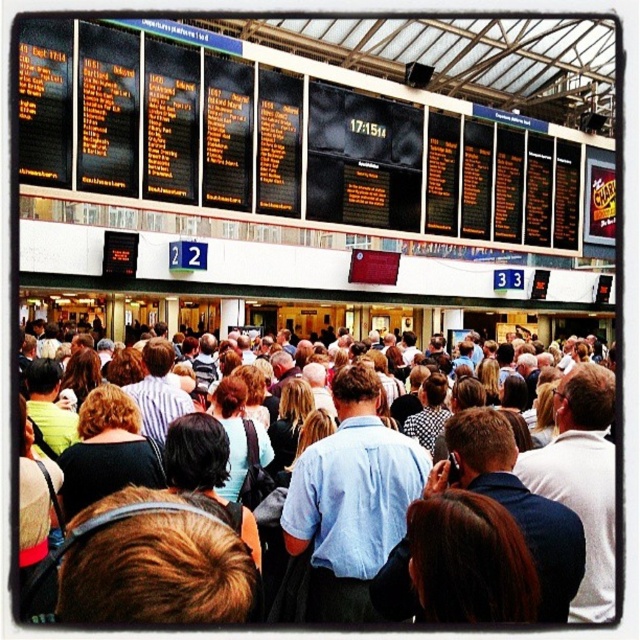
Question: Can you confirm if black digital display at upper center is positioned to the left of brown hair at center?

Choices:
 (A) no
 (B) yes

Answer: (A)

Question: Can you confirm if black digital display at upper center is smaller than brown hair at center?

Choices:
 (A) yes
 (B) no

Answer: (B)

Question: Is black digital display at upper center below brown hair at center?

Choices:
 (A) no
 (B) yes

Answer: (A)

Question: Which object appears closest to the camera in this image?

Choices:
 (A) brown hair at center
 (B) black digital display at upper center

Answer: (A)